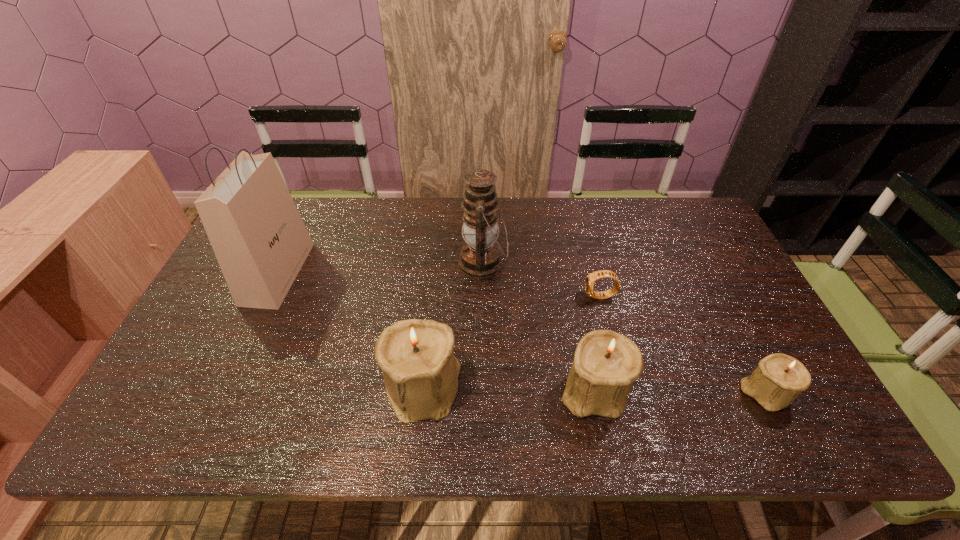
At what (x,y) coordinates should I click in order to perform the action: click on free space between the second shortest object and the leftmost object. Please return your answer as a coordinate pair (x, y). The width and height of the screenshot is (960, 540). Looking at the image, I should click on (522, 333).

Where is `vacant space that is in between the tallest object and the leftmost candle_holder`? vacant space that is in between the tallest object and the leftmost candle_holder is located at coordinates (350, 330).

Where is `free space between the watch and the tallest object`? free space between the watch and the tallest object is located at coordinates (439, 285).

Image resolution: width=960 pixels, height=540 pixels. Find the location of `vacant region between the shortest object and the fifth shortest object`. vacant region between the shortest object and the fifth shortest object is located at coordinates (541, 280).

Where is `free point between the shortest object and the lantern`? Image resolution: width=960 pixels, height=540 pixels. free point between the shortest object and the lantern is located at coordinates (541, 280).

Find the location of a particular element. The height and width of the screenshot is (540, 960). free space between the leftmost candle_holder and the shortest object is located at coordinates (512, 342).

Where is `object that stands as the second closest to the second tallest candle_holder`? The height and width of the screenshot is (540, 960). object that stands as the second closest to the second tallest candle_holder is located at coordinates (416, 356).

Locate which object ranks in proximity to the tallest object. Please provide its 2D coordinates. Your answer should be formatted as a tuple, i.e. [(x, y)], where the tuple contains the x and y coordinates of a point satisfying the conditions above.

[(416, 356)]

Identify which candle_holder is the second nearest to the shortest object. Please provide its 2D coordinates. Your answer should be formatted as a tuple, i.e. [(x, y)], where the tuple contains the x and y coordinates of a point satisfying the conditions above.

[(778, 379)]

Locate an element on the screen. candle_holder that can be found as the closest to the leftmost candle_holder is located at coordinates (606, 363).